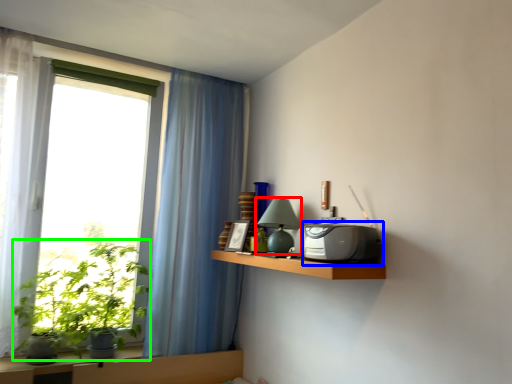
Question: Considering the real-world distances, which object is farthest from table lamp (highlighted by a red box)? appliance (highlighted by a blue box) or plant (highlighted by a green box)?

Choices:
 (A) appliance
 (B) plant

Answer: (B)